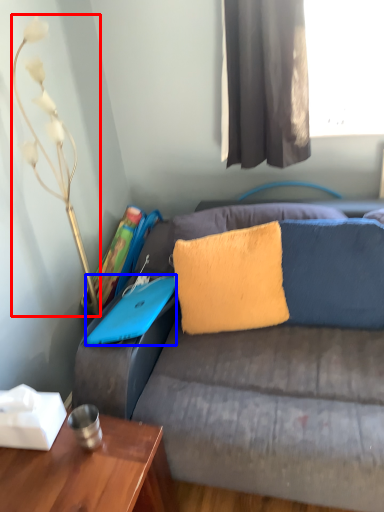
Question: Which of the following is the closest to the observer, lamp (highlighted by a red box) or laptop (highlighted by a blue box)?

Choices:
 (A) lamp
 (B) laptop

Answer: (A)